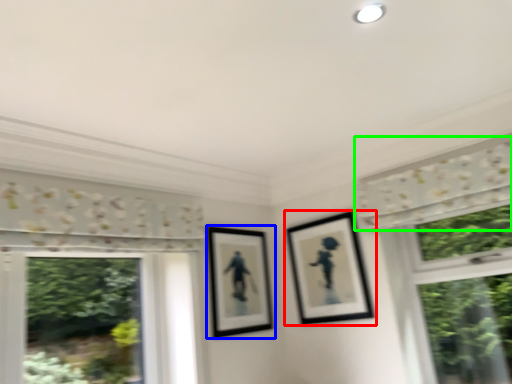
Question: Which object is positioned closest to picture frame (highlighted by a red box)? Select from picture frame (highlighted by a blue box) and curtain (highlighted by a green box).

Choices:
 (A) picture frame
 (B) curtain

Answer: (A)